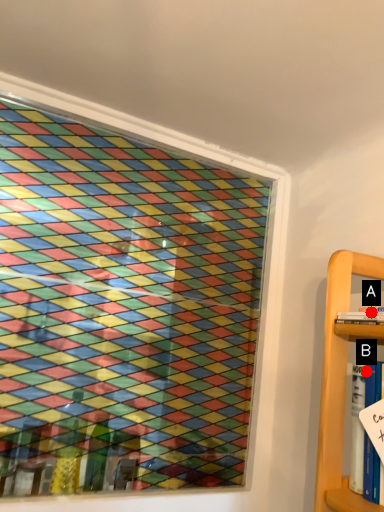
Question: Two points are circled on the image, labeled by A and B beside each circle. Which point is farther from the camera taking this photo?

Choices:
 (A) A is further
 (B) B is further

Answer: (A)